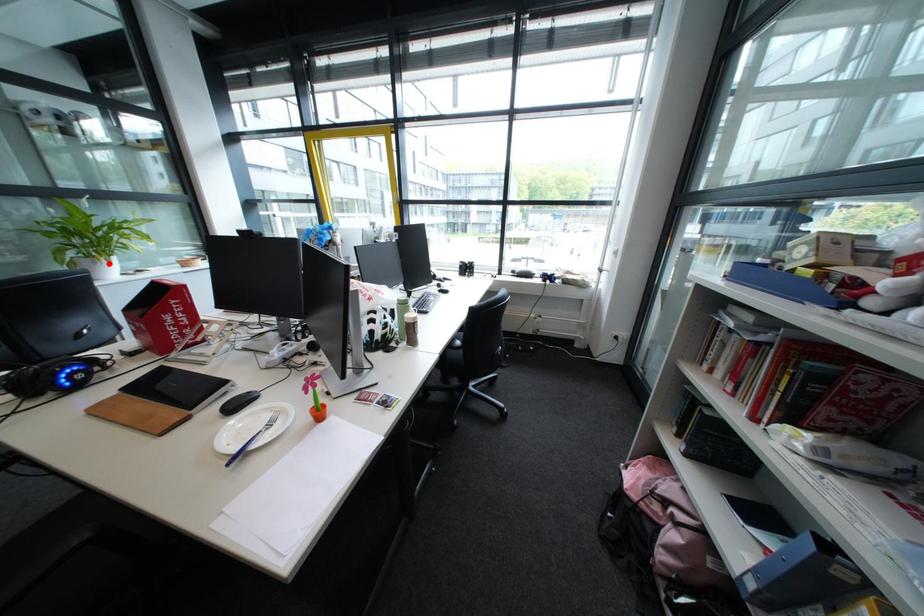
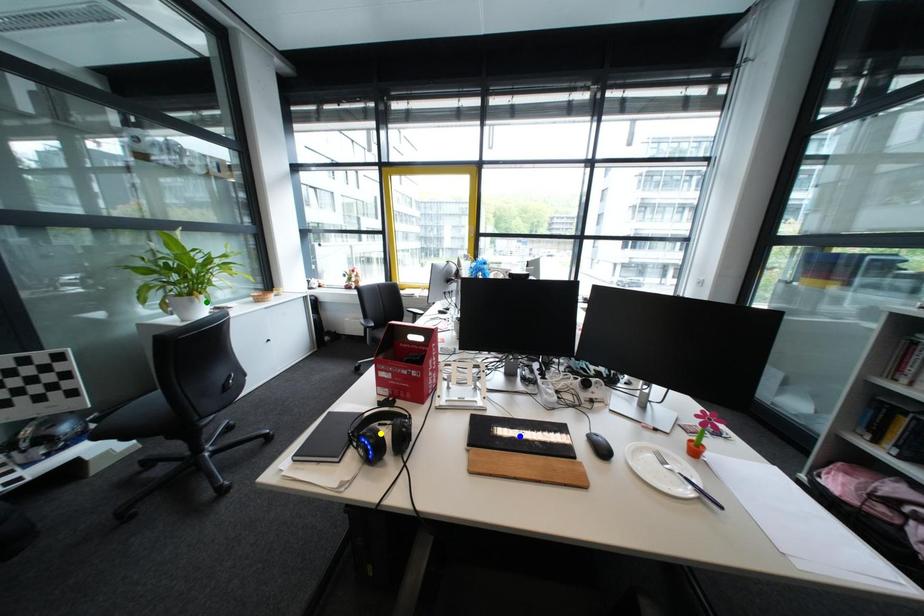
Question: I am providing you with two images of the same scene from different viewpoints. A red point is marked on the first image. You are given multiple points on the second image. Which mark in image 2 goes with the point in image 1?

Choices:
 (A) yellow point
 (B) green point
 (C) blue point

Answer: (B)